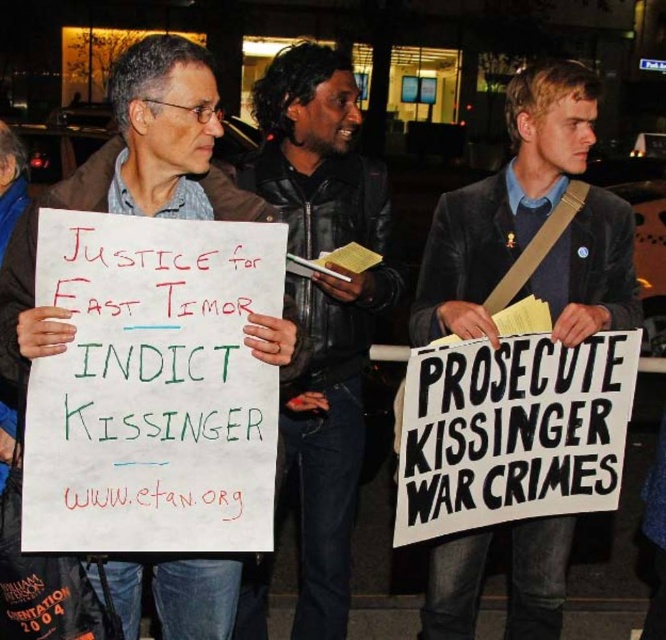
Is black leather jacket at center taller than white paper sign at left?

Correct, black leather jacket at center is much taller as white paper sign at left.

Is point (258, 150) positioned behind point (276, 360)?

That is True.

At what (x,y) coordinates should I click in order to perform the action: click on black leather jacket at center. Please return your answer as a coordinate pair (x, y). Looking at the image, I should click on (328, 435).

Does dark gray suit at center appear on the right side of black leather jacket at center?

Correct, you'll find dark gray suit at center to the right of black leather jacket at center.

The image size is (666, 640). I want to click on dark gray suit at center, so tap(505, 202).

Between point (513, 132) and point (182, 202), which one is positioned in front?

Point (182, 202)

Does dark gray suit at center appear on the left side of white paper sign at left?

In fact, dark gray suit at center is to the right of white paper sign at left.

Which is in front, point (565, 77) or point (198, 568)?

Point (198, 568)

This screenshot has height=640, width=666. What are the coordinates of `dark gray suit at center` in the screenshot? It's located at (505, 202).